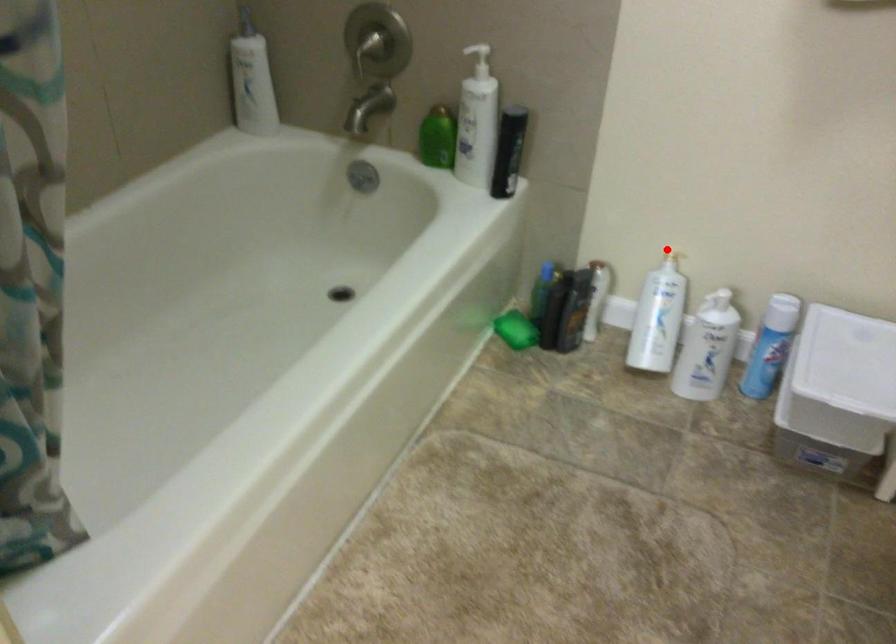
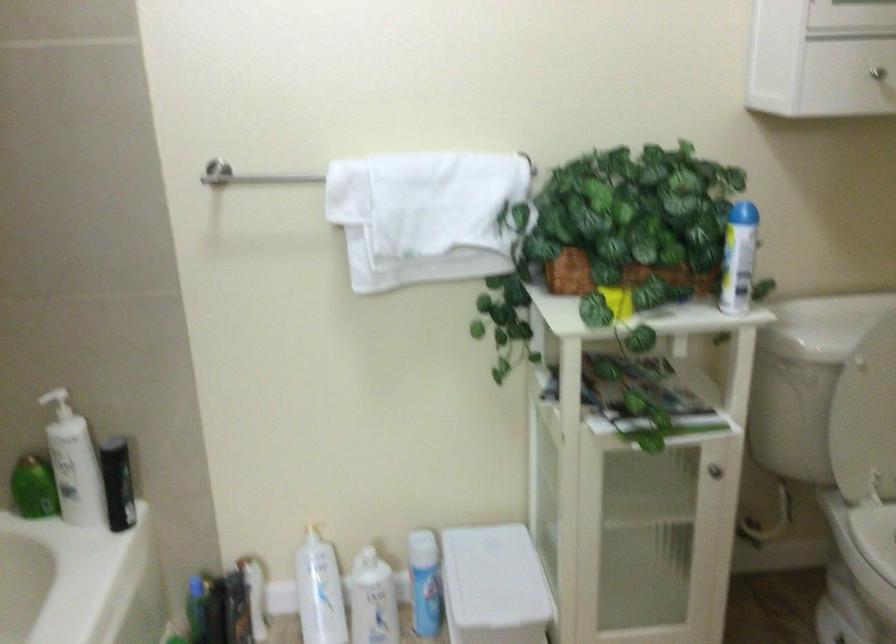
The point at the highlighted location is marked in the first image. Where is the corresponding point in the second image?

(306, 523)